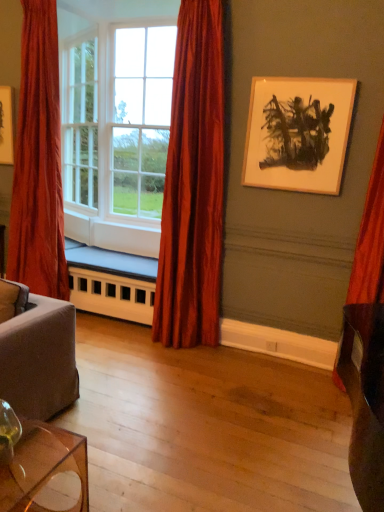
Question: Can you confirm if wooden picture frame at upper right is wider than velvet red curtain at right, placed as the first curtain when sorted from right to left?

Choices:
 (A) yes
 (B) no

Answer: (B)

Question: Is wooden picture frame at upper right far away from velvet red curtain at right, acting as the 3th curtain starting from the left?

Choices:
 (A) no
 (B) yes

Answer: (A)

Question: Does wooden picture frame at upper right have a greater height compared to velvet red curtain at right, placed as the first curtain when sorted from right to left?

Choices:
 (A) no
 (B) yes

Answer: (A)

Question: Considering the relative positions of wooden picture frame at upper right and velvet red curtain at right, placed as the first curtain when sorted from right to left, in the image provided, is wooden picture frame at upper right to the right of velvet red curtain at right, placed as the first curtain when sorted from right to left, from the viewer's perspective?

Choices:
 (A) no
 (B) yes

Answer: (A)

Question: Can velvet red curtain at right, placed as the first curtain when sorted from right to left, be found inside wooden picture frame at upper right?

Choices:
 (A) yes
 (B) no

Answer: (B)

Question: Considering their positions, is velvet red curtain at left, placed as the third curtain when sorted from right to left, located in front of or behind white glass window at center?

Choices:
 (A) front
 (B) behind

Answer: (A)

Question: Is point (13, 237) closer or farther from the camera than point (109, 98)?

Choices:
 (A) closer
 (B) farther

Answer: (A)

Question: Is velvet red curtain at left, placed as the third curtain when sorted from right to left, taller or shorter than white glass window at center?

Choices:
 (A) short
 (B) tall

Answer: (B)

Question: From the image's perspective, is velvet red curtain at left, the 1th curtain positioned from the left, located above or below white glass window at center?

Choices:
 (A) above
 (B) below

Answer: (B)

Question: Looking at their shapes, would you say silky red curtain at center, which ranks as the 2th curtain in left-to-right order, is wider or thinner than white painted wood radiator at lower center?

Choices:
 (A) thin
 (B) wide

Answer: (A)

Question: Is silky red curtain at center, which appears as the 2th curtain when viewed from the right, bigger or smaller than white painted wood radiator at lower center?

Choices:
 (A) big
 (B) small

Answer: (A)

Question: From a real-world perspective, is silky red curtain at center, which ranks as the 2th curtain in left-to-right order, positioned above or below white painted wood radiator at lower center?

Choices:
 (A) below
 (B) above

Answer: (B)

Question: Based on their positions, is silky red curtain at center, which appears as the 2th curtain when viewed from the right, located to the left or right of white painted wood radiator at lower center?

Choices:
 (A) right
 (B) left

Answer: (A)

Question: Is point click(117, 151) closer or farther from the camera than point click(97, 287)?

Choices:
 (A) farther
 (B) closer

Answer: (A)

Question: Looking at their shapes, would you say white glass window at center is wider or thinner than white painted wood radiator at lower center?

Choices:
 (A) wide
 (B) thin

Answer: (A)